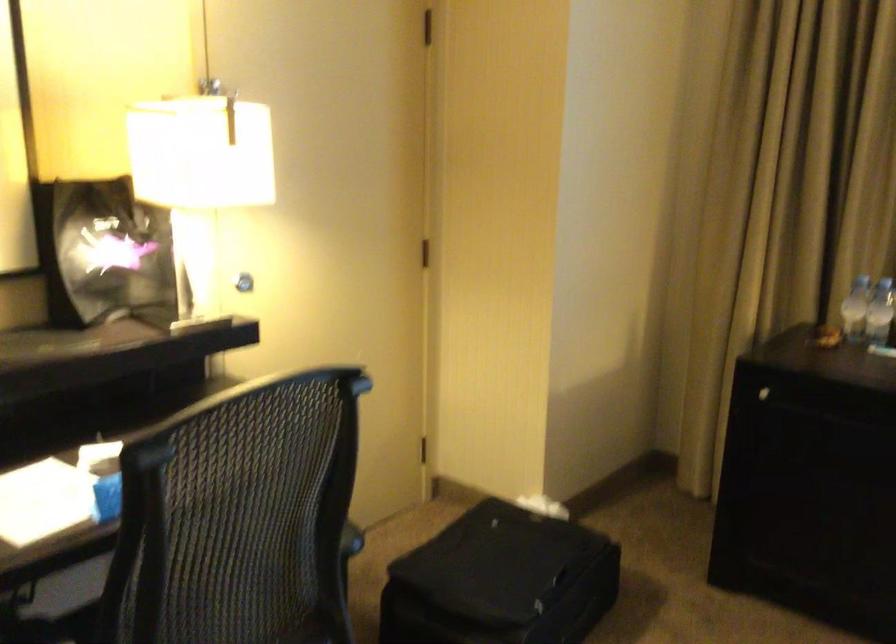
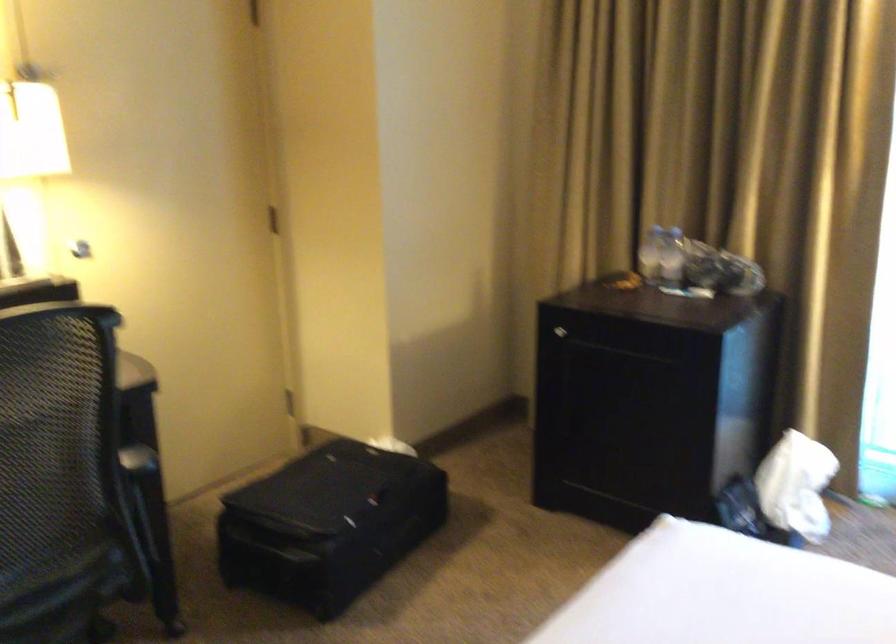
Question: The camera is either moving clockwise (left) or counter-clockwise (right) around the object. The first image is from the beginning of the video and the second image is from the end. Is the camera moving left or right when shooting the video?

Choices:
 (A) Left
 (B) Right

Answer: (A)